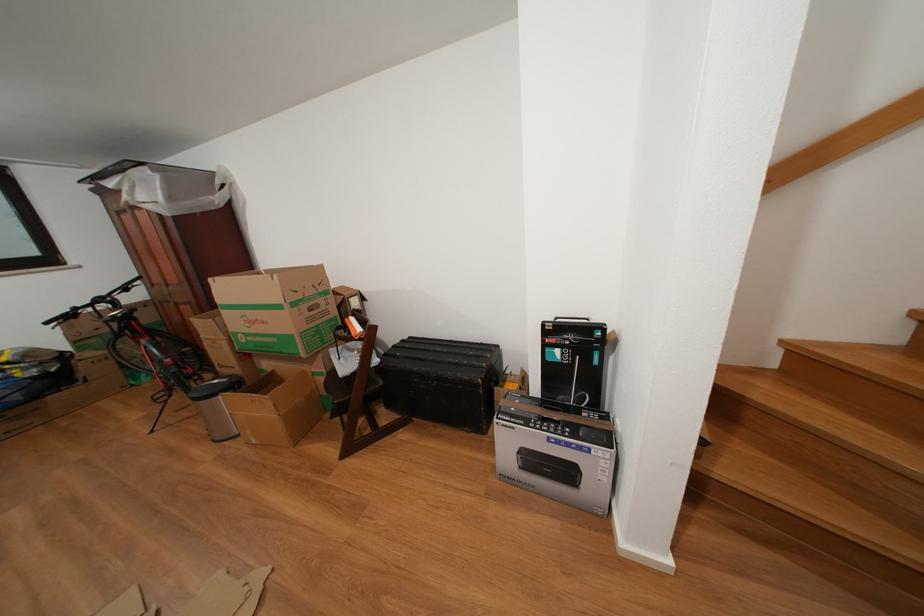
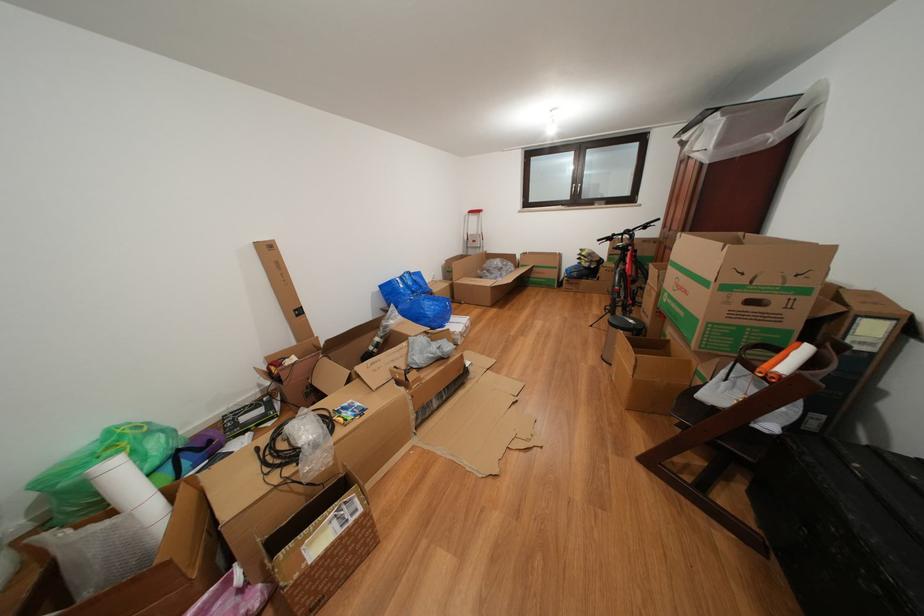
Locate, in the second image, the point that corresponds to (x=381, y=371) in the first image.

(763, 431)